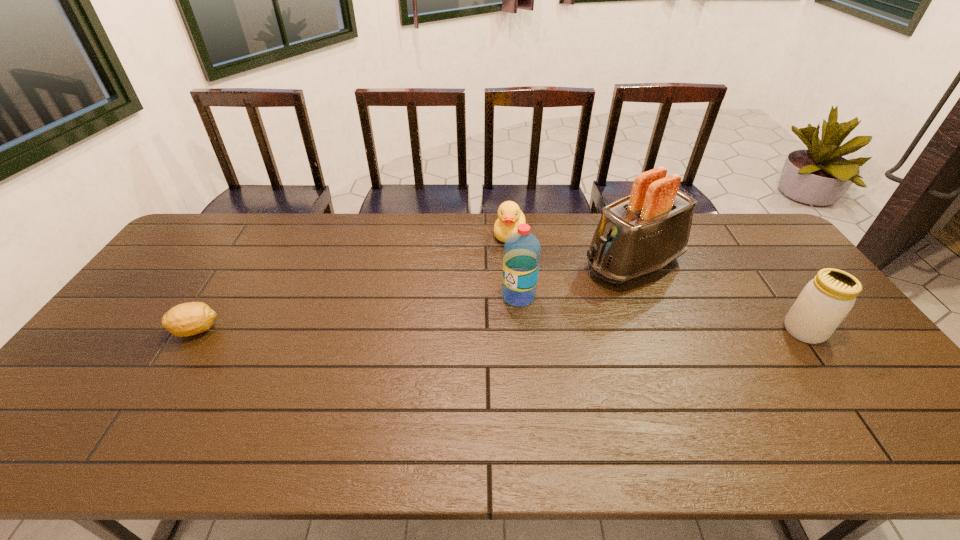
Locate an element on the screen. vacant area situated on the side of the toaster with the control lever is located at coordinates (558, 295).

At what (x,y) coordinates should I click in order to perform the action: click on duck at the far edge. Please return your answer as a coordinate pair (x, y). Image resolution: width=960 pixels, height=540 pixels. Looking at the image, I should click on (510, 216).

This screenshot has width=960, height=540. Identify the location of toaster located at the far edge. (639, 234).

Identify the location of object that is at the right edge. The image size is (960, 540). (825, 301).

Locate an element on the screen. This screenshot has width=960, height=540. vacant space at the far edge is located at coordinates (374, 232).

In order to click on free space at the near edge of the desktop in this screenshot , I will do `click(501, 402)`.

This screenshot has width=960, height=540. I want to click on blank space at the right edge, so click(876, 363).

What are the coordinates of `vacant area that lies between the shortest object and the second object from right to left` in the screenshot? It's located at (415, 297).

Where is `vacant area that lies between the rightmost object and the leftmost object`? The image size is (960, 540). vacant area that lies between the rightmost object and the leftmost object is located at coordinates (500, 330).

You are a GUI agent. You are given a task and a screenshot of the screen. Output one action in this format:
    pyautogui.click(x=<x>, y=<y>)
    Task: Click on the vacant point located between the fourth object from left to right and the jar
    The height and width of the screenshot is (540, 960).
    Given the screenshot: What is the action you would take?
    pyautogui.click(x=718, y=297)